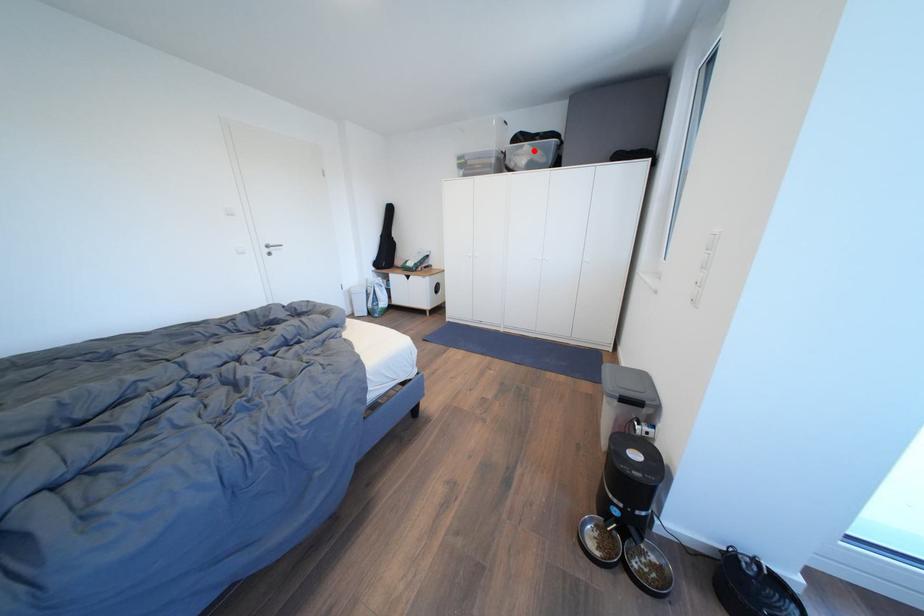
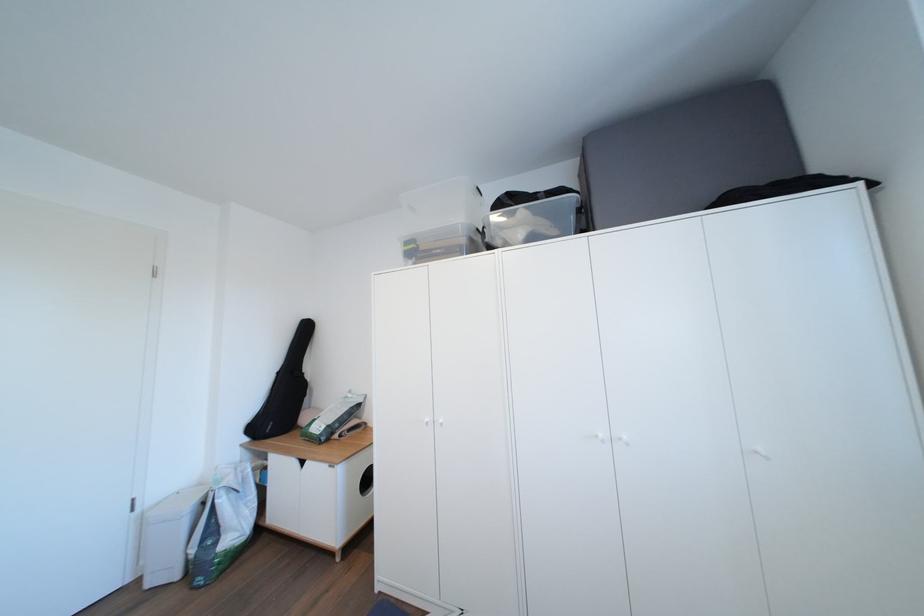
The point at the highlighted location is marked in the first image. Where is the corresponding point in the second image?

(529, 215)